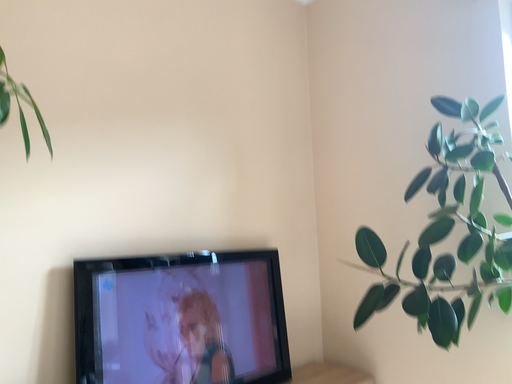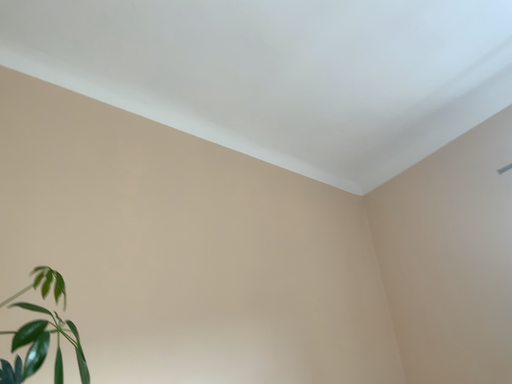
Question: How did the camera likely rotate when shooting the video?

Choices:
 (A) rotated right
 (B) rotated left

Answer: (B)